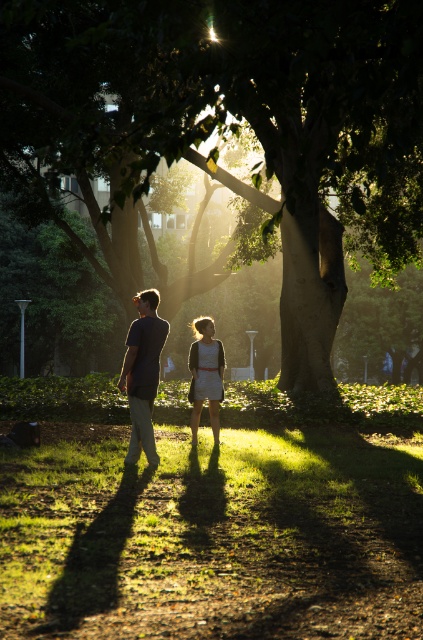
You are a photographer trying to capture the scene with the green leafy tree at center and the matte gray shirt at center. Which object should you focus on first if you want to ensure both are in sharp focus?

The green leafy tree at center is above matte gray shirt at center, so you should focus on the matte gray shirt at center first to ensure both are in sharp focus.

You are a photographer trying to capture a photo of the matte gray shirt at center and the matte white dress at center. Since you want to highlight both subjects equally, which one should you position to the left to ensure they are framed properly?

The matte gray shirt at center is already positioned on the left side of the matte white dress at center, so to frame them equally, the photographer should keep the matte gray shirt at center on the left and the matte white dress at center on the right.